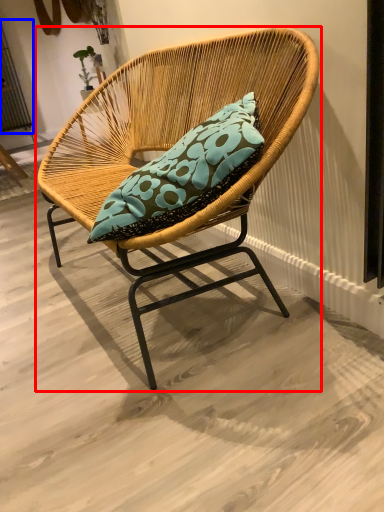
Question: Among these objects, which one is farthest to the camera, chair (highlighted by a red box) or screen door (highlighted by a blue box)?

Choices:
 (A) chair
 (B) screen door

Answer: (B)